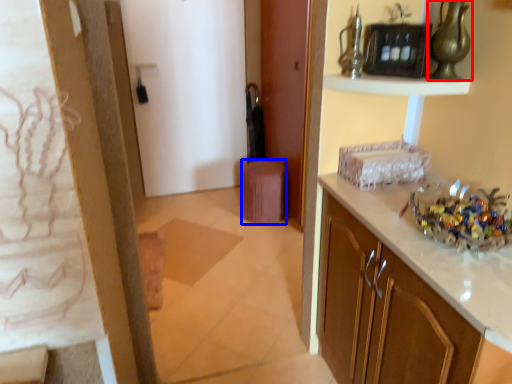
Question: Among these objects, which one is nearest to the camera, glass vase (highlighted by a red box) or stool (highlighted by a blue box)?

Choices:
 (A) glass vase
 (B) stool

Answer: (A)